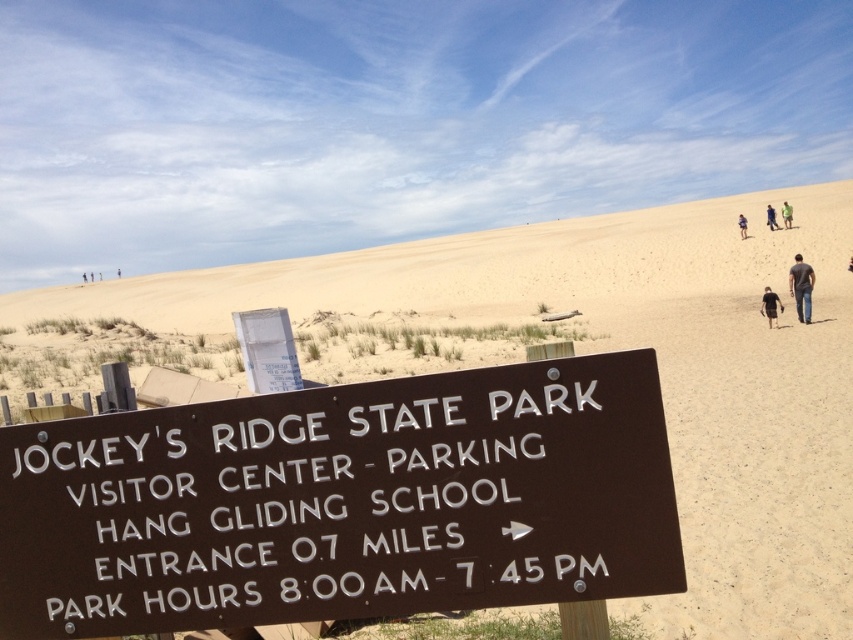
Consider the image. Is brown polished wood sign at center smaller than blue fabric shirt at upper center?

No, brown polished wood sign at center is not smaller than blue fabric shirt at upper center.

Does brown polished wood sign at center appear under blue fabric shirt at upper center?

Indeed, brown polished wood sign at center is positioned under blue fabric shirt at upper center.

Describe the element at coordinates (343, 502) in the screenshot. I see `brown polished wood sign at center` at that location.

At what (x,y) coordinates should I click in order to perform the action: click on brown polished wood sign at center. Please return your answer as a coordinate pair (x, y). Looking at the image, I should click on (343, 502).

Who is shorter, green fabric pants at upper right or blue fabric shirt at upper center?

blue fabric shirt at upper center is shorter.

The height and width of the screenshot is (640, 853). What do you see at coordinates (770, 218) in the screenshot?
I see `green fabric pants at upper right` at bounding box center [770, 218].

The width and height of the screenshot is (853, 640). In order to click on green fabric pants at upper right in this screenshot , I will do `click(770, 218)`.

Between point (462, 467) and point (770, 220), which one is positioned in front?

Point (462, 467) is in front.

Find the location of a particular element. The width and height of the screenshot is (853, 640). brown polished wood sign at center is located at coordinates (343, 502).